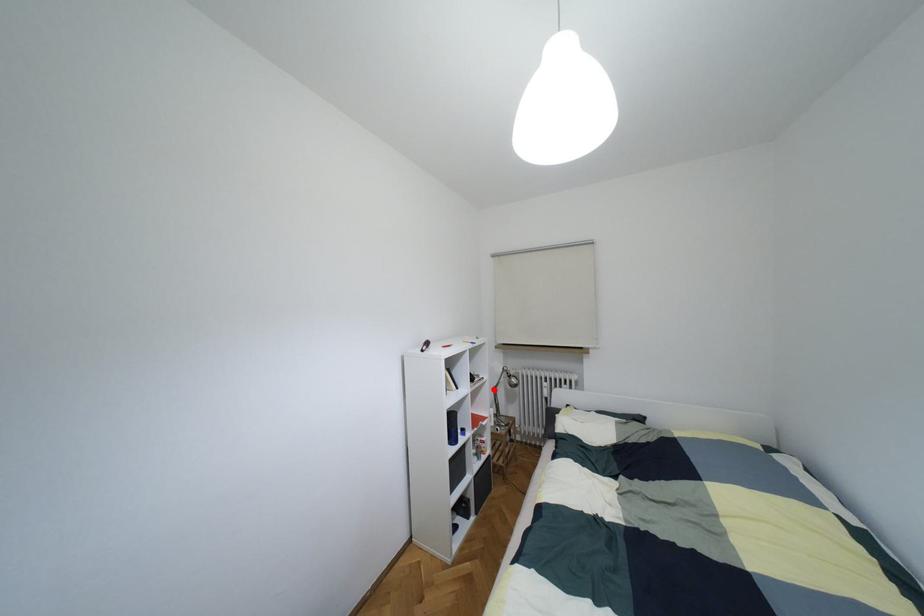
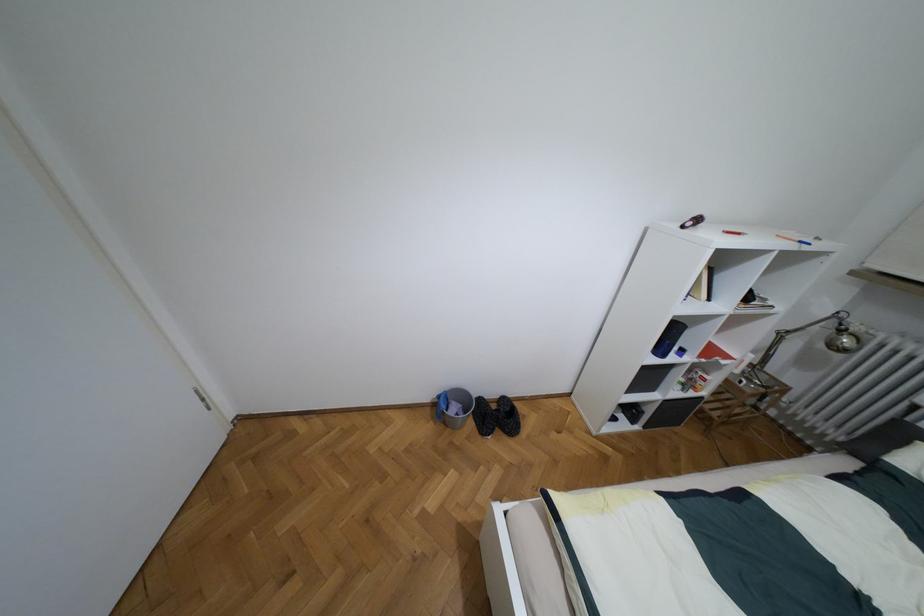
Where in the second image is the point corresponding to the highlighted location from the first image?

(781, 334)